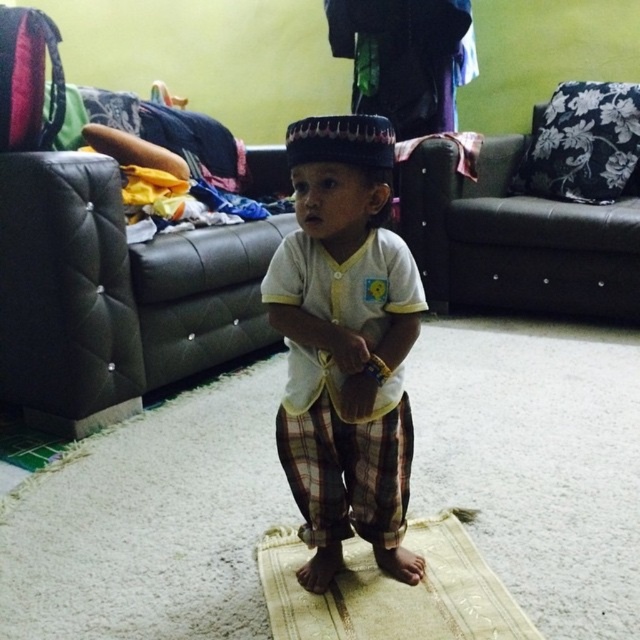
Which is above, white cotton shirt at center or beige woven mat at center?

white cotton shirt at center

Image resolution: width=640 pixels, height=640 pixels. Find the location of `white cotton shirt at center`. white cotton shirt at center is located at coordinates (344, 346).

Where is `white cotton shirt at center`? This screenshot has width=640, height=640. white cotton shirt at center is located at coordinates (344, 346).